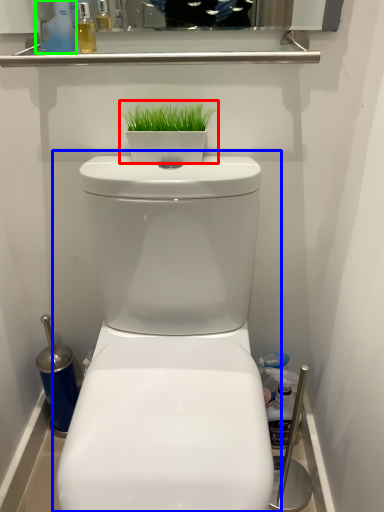
Question: Based on their relative distances, which object is nearer to houseplant (highlighted by a red box)? Choose from toilet (highlighted by a blue box) and cleaning product (highlighted by a green box).

Choices:
 (A) toilet
 (B) cleaning product

Answer: (B)